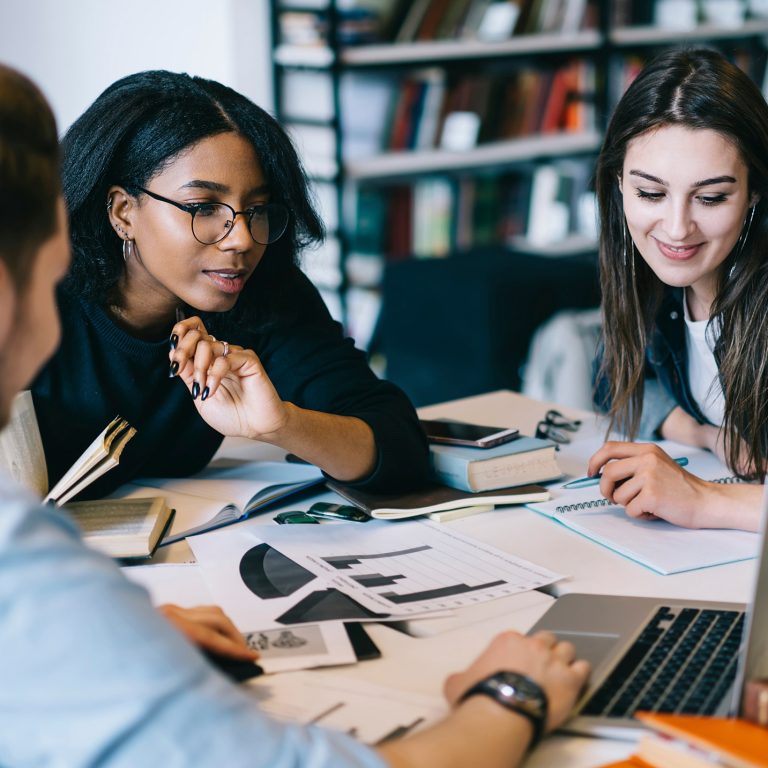
Locate an element on the screen. This screenshot has height=768, width=768. closed book is located at coordinates (475, 469).